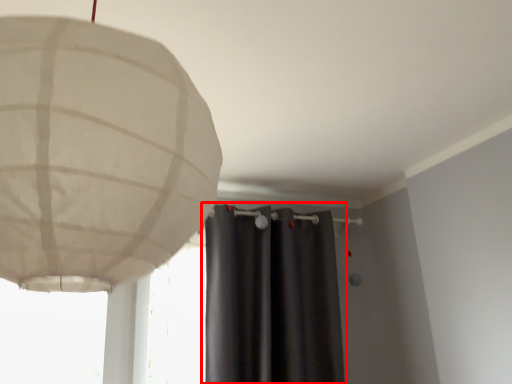
Question: Observing the image, what is the correct spatial positioning of curtain (annotated by the red box) in reference to lamp?

Choices:
 (A) right
 (B) left

Answer: (A)